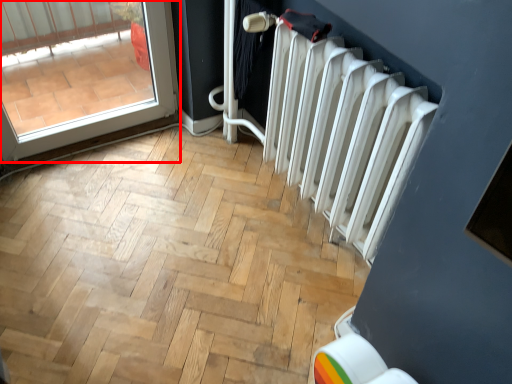
Question: From the image's perspective, where is door (annotated by the red box) located relative to radiator?

Choices:
 (A) below
 (B) above

Answer: (B)